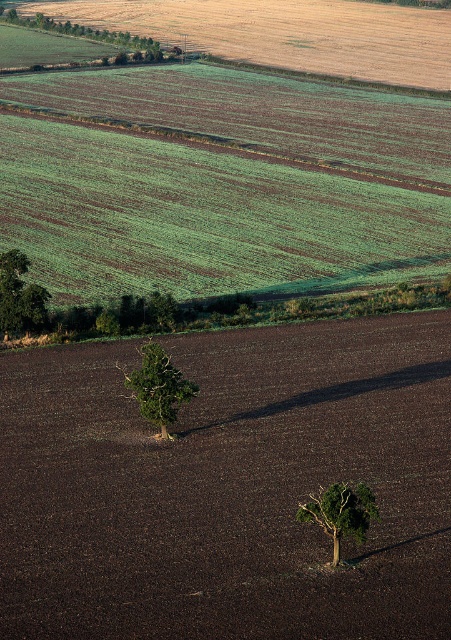
You are a farmer planning to plant new crops between the green leafy tree at center and the green matte tree at center. Which tree should you use as a reference point if you want to plant closer to the left side of the field?

You should use the green leafy tree at center as your reference point because it is positioned to the left of the green matte tree at center, making it closer to the left side of the field.

You are a drone operator flying over the rural landscape. You notice both the green leafy tree at center and the green grassy field at center. Which one is closer to your drone?

The green leafy tree at center is closer to the drone because it is in front of the green grassy field at center.

Based on the photo, you are a drone operator flying over the rural landscape. You need to determine the order of two points from your current position. Which point, point (404, 544) or point (141, 380), is closer to you?

Point (404, 544) is in front of point (141, 380), so it is closer to you.